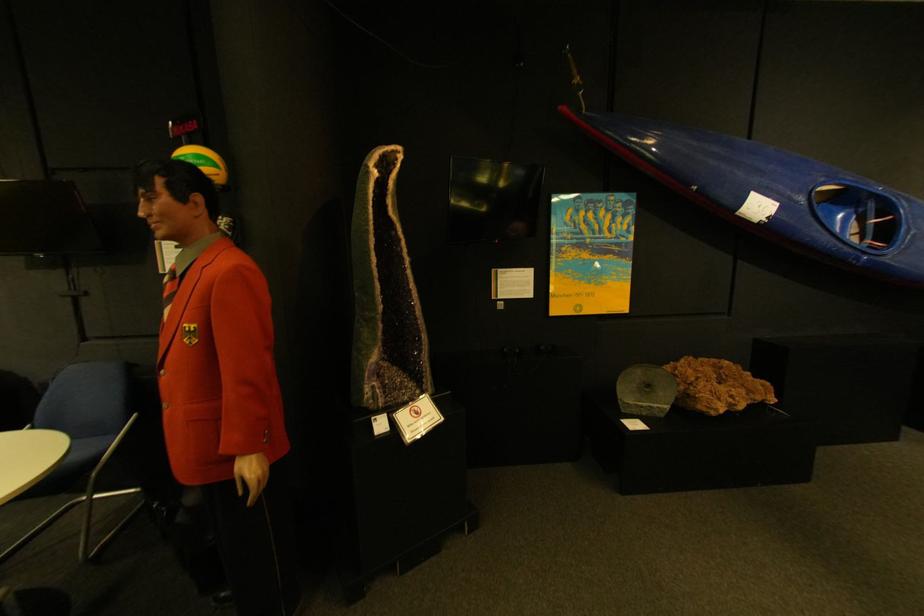
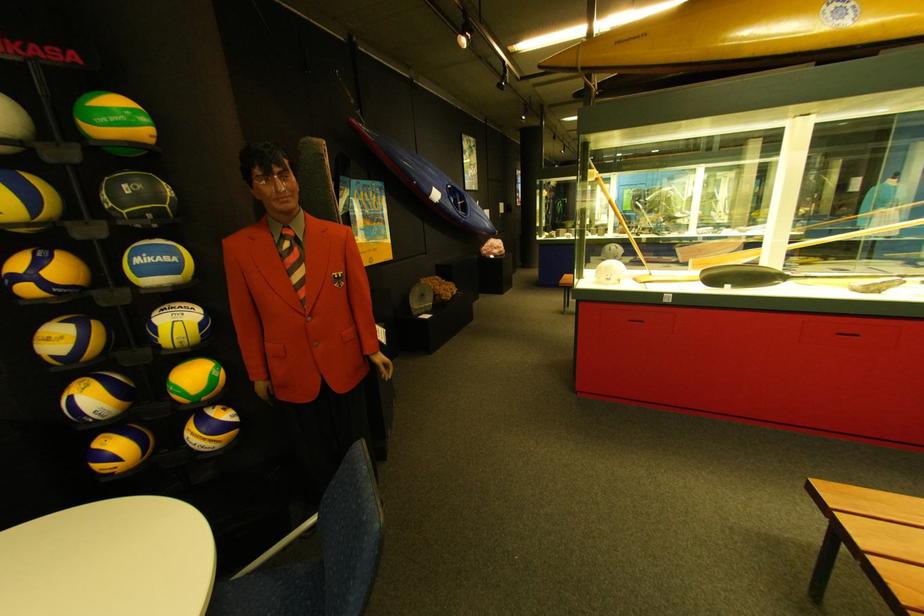
Locate, in the second image, the point that corresponds to [665,387] in the first image.

(438, 297)